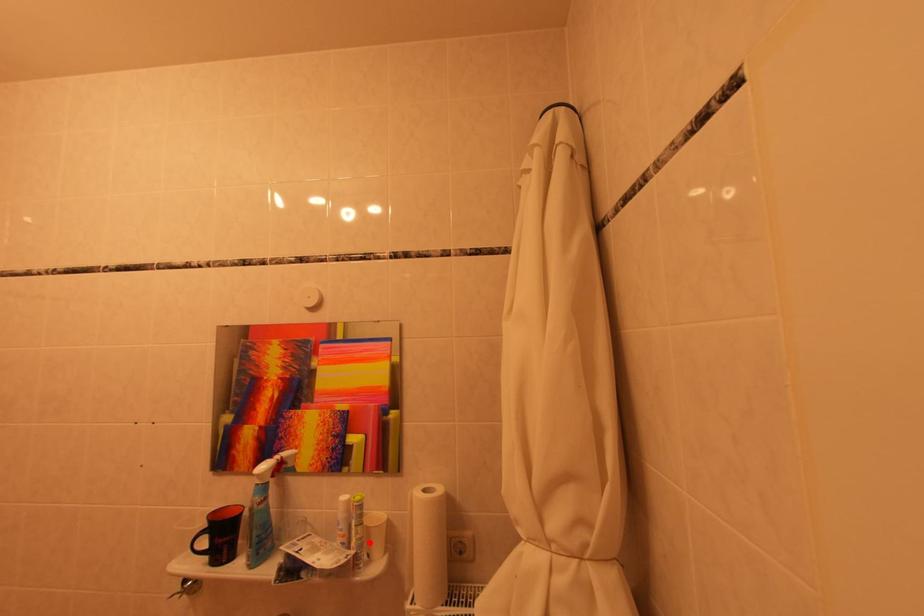
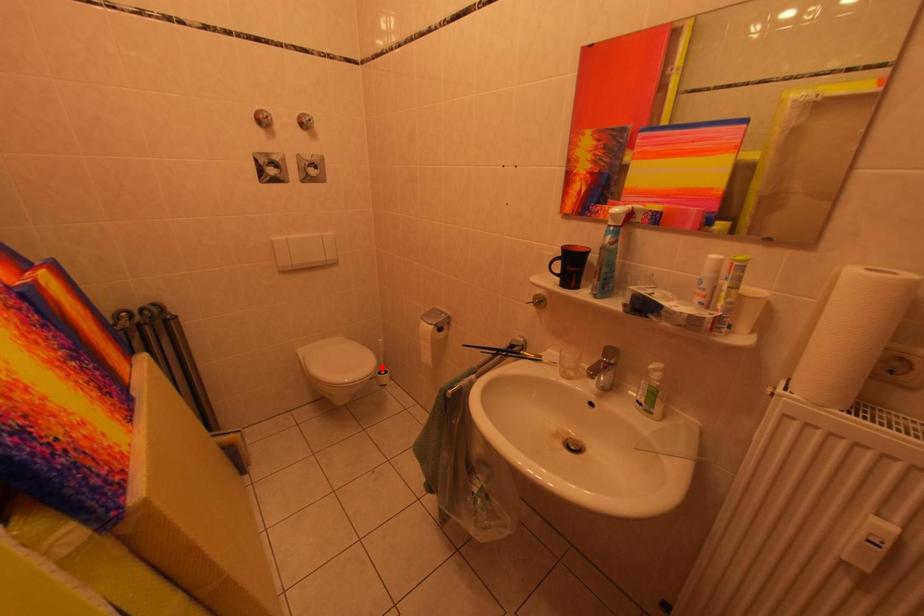
I am providing you with two images of the same scene from different viewpoints. A red point is marked on the first image and another point is marked on the second image. Is the red point in image1 aligned with the point shown in image2?

No